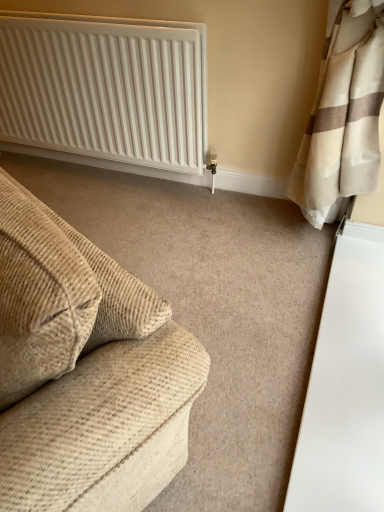
You are a GUI agent. You are given a task and a screenshot of the screen. Output one action in this format:
    pyautogui.click(x=<x>, y=<y>)
    Task: Click on the beige corduroy couch at left
    The height and width of the screenshot is (512, 384).
    Given the screenshot: What is the action you would take?
    pyautogui.click(x=85, y=371)

This screenshot has height=512, width=384. What do you see at coordinates (85, 371) in the screenshot?
I see `beige corduroy couch at left` at bounding box center [85, 371].

This screenshot has height=512, width=384. Identify the location of white ribbed radiator at upper left. (105, 90).

What do you see at coordinates (105, 90) in the screenshot? I see `white ribbed radiator at upper left` at bounding box center [105, 90].

Find the location of a particular element. beige corduroy couch at left is located at coordinates (85, 371).

Which object is positioned more to the right, beige corduroy couch at left or white ribbed radiator at upper left?

From the viewer's perspective, beige corduroy couch at left appears more on the right side.

Is beige corduroy couch at left closer to camera compared to white ribbed radiator at upper left?

Yes.

Does point (105, 301) lie in front of point (33, 74)?

Yes, point (105, 301) is in front of point (33, 74).

From the image's perspective, is beige corduroy couch at left located above or below white ribbed radiator at upper left?

From the image's perspective, beige corduroy couch at left appears below white ribbed radiator at upper left.

From a real-world perspective, which object stands above the other?

beige corduroy couch at left, from a real-world perspective.

Which object is thinner, beige corduroy couch at left or white ribbed radiator at upper left?

white ribbed radiator at upper left is thinner.

Who is taller, beige corduroy couch at left or white ribbed radiator at upper left?

white ribbed radiator at upper left.

Does beige corduroy couch at left have a larger size compared to white ribbed radiator at upper left?

Yes.

Can we say beige corduroy couch at left lies outside white ribbed radiator at upper left?

That's correct, beige corduroy couch at left is outside of white ribbed radiator at upper left.

Does beige corduroy couch at left touch white ribbed radiator at upper left?

No, beige corduroy couch at left is not touching white ribbed radiator at upper left.

Is beige corduroy couch at left looking in the opposite direction of white ribbed radiator at upper left?

No, beige corduroy couch at left is not facing the opposite direction of white ribbed radiator at upper left.

What's the angular difference between beige corduroy couch at left and white ribbed radiator at upper left's facing directions?

beige corduroy couch at left and white ribbed radiator at upper left are facing 25.7 degrees away from each other.

Where is `studio couch located above the white ribbed radiator at upper left (from a real-world perspective)`? The height and width of the screenshot is (512, 384). studio couch located above the white ribbed radiator at upper left (from a real-world perspective) is located at coordinates (85, 371).

Which object is positioned more to the left, white ribbed radiator at upper left or beige corduroy couch at left?

Positioned to the left is white ribbed radiator at upper left.

Does white ribbed radiator at upper left come in front of beige corduroy couch at left?

No, white ribbed radiator at upper left is further to the viewer.

Which is less distant, (196, 136) or (130, 482)?

Point (196, 136) appears to be farther away from the viewer than point (130, 482).

Looking at this image, from the image's perspective, is white ribbed radiator at upper left on beige corduroy couch at left?

Indeed, from the image's perspective, white ribbed radiator at upper left is shown above beige corduroy couch at left.

From a real-world perspective, which object rests below the other?

From a 3D spatial view, white ribbed radiator at upper left is below.

Does white ribbed radiator at upper left have a lesser width compared to beige corduroy couch at left?

Correct, the width of white ribbed radiator at upper left is less than that of beige corduroy couch at left.

Is white ribbed radiator at upper left shorter than beige corduroy couch at left?

In fact, white ribbed radiator at upper left may be taller than beige corduroy couch at left.

Is white ribbed radiator at upper left bigger or smaller than beige corduroy couch at left?

white ribbed radiator at upper left is smaller than beige corduroy couch at left.

Is white ribbed radiator at upper left surrounding beige corduroy couch at left?

No.

Is white ribbed radiator at upper left positioned far away from beige corduroy couch at left?

That's right, there is a large distance between white ribbed radiator at upper left and beige corduroy couch at left.

Does white ribbed radiator at upper left turn towards beige corduroy couch at left?

Yes, white ribbed radiator at upper left is facing beige corduroy couch at left.

How many degrees apart are the facing directions of white ribbed radiator at upper left and beige corduroy couch at left?

25.7 degrees separate the facing orientations of white ribbed radiator at upper left and beige corduroy couch at left.

How far apart are white ribbed radiator at upper left and beige corduroy couch at left?

4.69 feet.

You are a GUI agent. You are given a task and a screenshot of the screen. Output one action in this format:
    pyautogui.click(x=<x>, y=<y>)
    Task: Click on the studio couch located on the right of white ribbed radiator at upper left
    
    Given the screenshot: What is the action you would take?
    pyautogui.click(x=85, y=371)

This screenshot has height=512, width=384. In the image, there is a beige corduroy couch at left. In order to click on radiator below it (from a real-world perspective) in this screenshot , I will do `click(105, 90)`.

Where is `radiator behind the beige corduroy couch at left`? This screenshot has width=384, height=512. radiator behind the beige corduroy couch at left is located at coordinates [x=105, y=90].